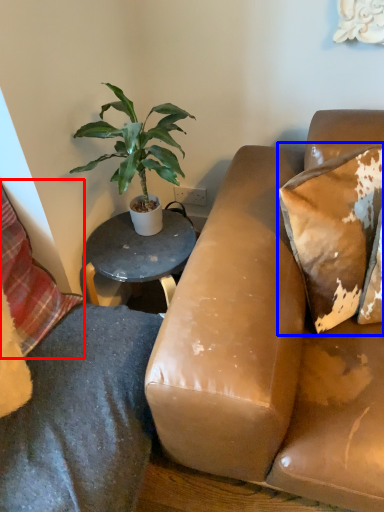
Question: Among these objects, which one is farthest to the camera, pillow (highlighted by a red box) or pillow (highlighted by a blue box)?

Choices:
 (A) pillow
 (B) pillow

Answer: (B)